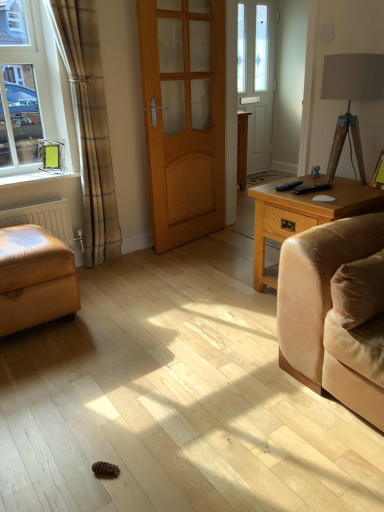
In order to click on free space below plaid fabric curtain at left (from a real-world perspective) in this screenshot , I will do `click(115, 259)`.